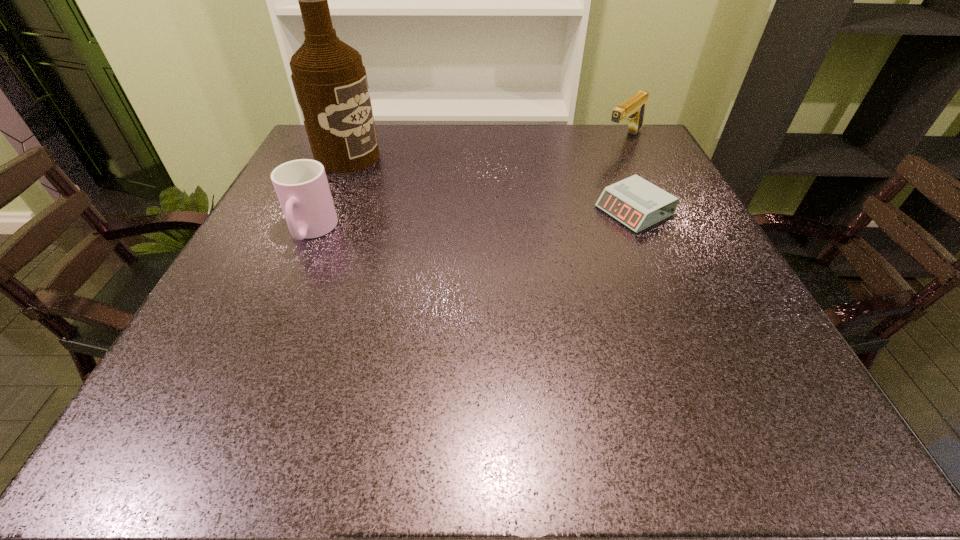
Locate an element on the screen. cup is located at coordinates (302, 188).

At what (x,y) coordinates should I click in order to perform the action: click on the shortest object. Please return your answer as a coordinate pair (x, y). This screenshot has width=960, height=540. Looking at the image, I should click on (636, 203).

Image resolution: width=960 pixels, height=540 pixels. Identify the location of pistol. (633, 109).

This screenshot has width=960, height=540. Identify the location of the tallest object. (330, 82).

At what (x,y) coordinates should I click in order to perform the action: click on free space located with the handle on the side of the cup. Please return your answer as a coordinate pair (x, y). Looking at the image, I should click on (246, 380).

This screenshot has height=540, width=960. Identify the location of blank space located on the front of the alarm clock. (698, 361).

Where is `free space located 0.060m at the barrel of the pistol`? free space located 0.060m at the barrel of the pistol is located at coordinates (602, 159).

You are a GUI agent. You are given a task and a screenshot of the screen. Output one action in this format:
    pyautogui.click(x=<x>, y=<y>)
    Task: Click on the vacant space located at the barrel of the pistol
    This screenshot has width=960, height=540.
    Given the screenshot: What is the action you would take?
    pyautogui.click(x=582, y=176)

The width and height of the screenshot is (960, 540). I want to click on vacant space located 0.170m at the barrel of the pistol, so click(x=580, y=177).

Find the location of `vacant space located on the label of the alcohol`. vacant space located on the label of the alcohol is located at coordinates (476, 210).